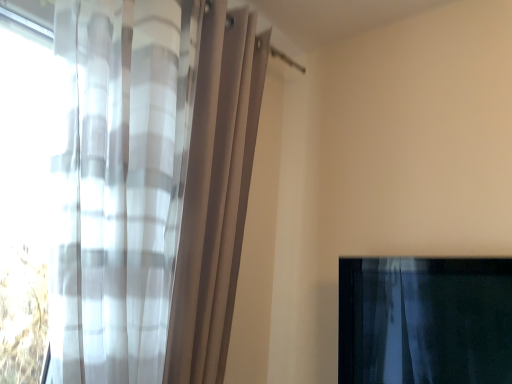
Question: From a real-world perspective, is translucent fabric curtain at lower right, positioned as the first curtain in right-to-left order, located higher than sheer white curtain at left, arranged as the first curtain when viewed from the left?

Choices:
 (A) no
 (B) yes

Answer: (A)

Question: Is translucent fabric curtain at lower right, arranged as the second curtain when viewed from the left, aimed at sheer white curtain at left, acting as the 2th curtain starting from the right?

Choices:
 (A) yes
 (B) no

Answer: (A)

Question: Can you confirm if translucent fabric curtain at lower right, arranged as the second curtain when viewed from the left, is positioned to the left of sheer white curtain at left, arranged as the first curtain when viewed from the left?

Choices:
 (A) no
 (B) yes

Answer: (A)

Question: Can you confirm if translucent fabric curtain at lower right, positioned as the first curtain in right-to-left order, is wider than sheer white curtain at left, acting as the 2th curtain starting from the right?

Choices:
 (A) no
 (B) yes

Answer: (A)

Question: Is sheer white curtain at left, arranged as the first curtain when viewed from the left, at the back of translucent fabric curtain at lower right, arranged as the second curtain when viewed from the left?

Choices:
 (A) no
 (B) yes

Answer: (A)

Question: Is translucent fabric curtain at lower right, positioned as the first curtain in right-to-left order, positioned in front of sheer white curtain at left, acting as the 2th curtain starting from the right?

Choices:
 (A) yes
 (B) no

Answer: (B)

Question: From the image's perspective, would you say sheer white curtain at left, acting as the 2th curtain starting from the right, is positioned over translucent fabric curtain at lower right, arranged as the second curtain when viewed from the left?

Choices:
 (A) no
 (B) yes

Answer: (B)

Question: Considering the relative sizes of sheer white curtain at left, arranged as the first curtain when viewed from the left, and translucent fabric curtain at lower right, positioned as the first curtain in right-to-left order, in the image provided, is sheer white curtain at left, arranged as the first curtain when viewed from the left, taller than translucent fabric curtain at lower right, positioned as the first curtain in right-to-left order,?

Choices:
 (A) yes
 (B) no

Answer: (A)

Question: Can you confirm if sheer white curtain at left, arranged as the first curtain when viewed from the left, is smaller than translucent fabric curtain at lower right, positioned as the first curtain in right-to-left order?

Choices:
 (A) no
 (B) yes

Answer: (A)

Question: Is sheer white curtain at left, arranged as the first curtain when viewed from the left, not near translucent fabric curtain at lower right, arranged as the second curtain when viewed from the left?

Choices:
 (A) no
 (B) yes

Answer: (A)

Question: Does sheer white curtain at left, acting as the 2th curtain starting from the right, have a greater width compared to translucent fabric curtain at lower right, arranged as the second curtain when viewed from the left?

Choices:
 (A) yes
 (B) no

Answer: (A)

Question: From a real-world perspective, is sheer white curtain at left, acting as the 2th curtain starting from the right, on top of translucent fabric curtain at lower right, positioned as the first curtain in right-to-left order?

Choices:
 (A) no
 (B) yes

Answer: (B)

Question: Based on their sizes in the image, would you say translucent fabric curtain at lower right, positioned as the first curtain in right-to-left order, is bigger or smaller than sheer white curtain at left, arranged as the first curtain when viewed from the left?

Choices:
 (A) big
 (B) small

Answer: (B)